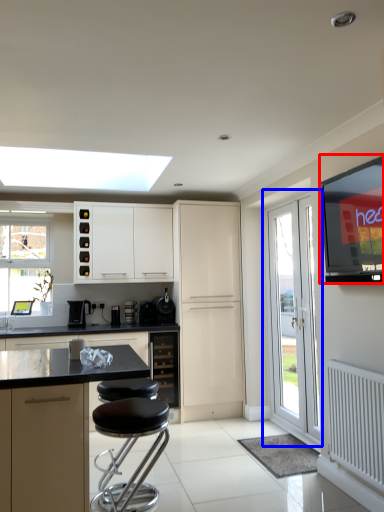
Question: Which object appears farthest to the camera in this image, window screen (highlighted by a red box) or door (highlighted by a blue box)?

Choices:
 (A) window screen
 (B) door

Answer: (B)